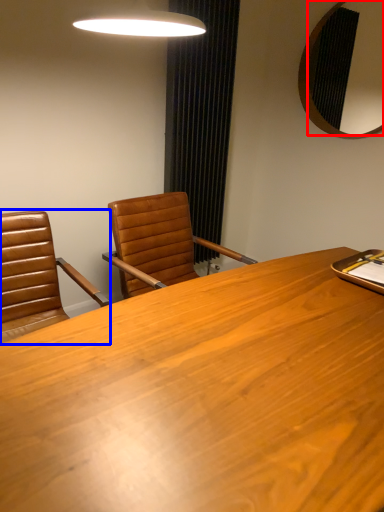
Question: Which object appears closest to the camera in this image, mirror (highlighted by a red box) or chair (highlighted by a blue box)?

Choices:
 (A) mirror
 (B) chair

Answer: (B)